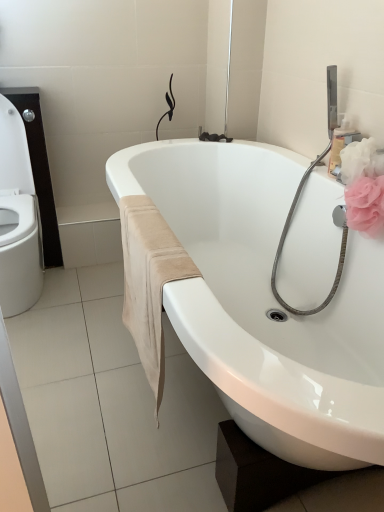
Where is `black rubber faucet at upper center`? black rubber faucet at upper center is located at coordinates (213, 137).

Where is `beige suede towel at lower center`? This screenshot has height=512, width=384. beige suede towel at lower center is located at coordinates (149, 281).

What do you see at coordinates (266, 302) in the screenshot? I see `white glossy bathtub at center` at bounding box center [266, 302].

I want to click on black rubber faucet at upper center, so click(x=213, y=137).

From the picture: Considering the sizes of objects beige suede towel at lower center and black rubber faucet at upper center in the image provided, who is wider, beige suede towel at lower center or black rubber faucet at upper center?

beige suede towel at lower center is wider.

Is point (149, 265) closer to viewer compared to point (217, 139)?

Yes, it is in front of point (217, 139).

From the image's perspective, between beige suede towel at lower center and black rubber faucet at upper center, who is located below?

beige suede towel at lower center is shown below in the image.

Does beige suede towel at lower center have a larger size compared to black rubber faucet at upper center?

Yes, beige suede towel at lower center is bigger than black rubber faucet at upper center.

Consider the image. Considering the relative sizes of black rubber faucet at upper center and pink fabric flower at upper right in the image provided, is black rubber faucet at upper center taller than pink fabric flower at upper right?

In fact, black rubber faucet at upper center may be shorter than pink fabric flower at upper right.

In the scene shown: Looking at their sizes, would you say black rubber faucet at upper center is wider or thinner than pink fabric flower at upper right?

Considering their sizes, black rubber faucet at upper center looks slimmer than pink fabric flower at upper right.

From the image's perspective, between black rubber faucet at upper center and pink fabric flower at upper right, which one is located above?

From the image's view, black rubber faucet at upper center is above.

Can you confirm if black rubber faucet at upper center is positioned to the right of pink fabric flower at upper right?

Incorrect, black rubber faucet at upper center is not on the right side of pink fabric flower at upper right.

Can you tell me how much pink fabric flower at upper right and black rubber faucet at upper center differ in facing direction?

They differ by 18.5 degrees in their facing directions.

Is pink fabric flower at upper right facing towards black rubber faucet at upper center?

No, pink fabric flower at upper right is not oriented towards black rubber faucet at upper center.

Which object is further away from the camera, pink fabric flower at upper right or black rubber faucet at upper center?

Positioned behind is black rubber faucet at upper center.

Is white glossy bathtub at center to the left or to the right of beige suede towel at lower center in the image?

white glossy bathtub at center is to the right of beige suede towel at lower center.

How many degrees apart are the facing directions of white glossy bathtub at center and beige suede towel at lower center?

white glossy bathtub at center and beige suede towel at lower center are facing 0.68 degrees away from each other.

Is white glossy bathtub at center taller or shorter than beige suede towel at lower center?

Clearly, white glossy bathtub at center is taller compared to beige suede towel at lower center.

Who is smaller, white glossy bathtub at center or beige suede towel at lower center?

beige suede towel at lower center.

Is beige suede towel at lower center in contact with pink fabric flower at upper right?

No, beige suede towel at lower center is not touching pink fabric flower at upper right.

Which is in front, beige suede towel at lower center or pink fabric flower at upper right?

beige suede towel at lower center is more forward.

Is beige suede towel at lower center oriented away from pink fabric flower at upper right?

Yes, pink fabric flower at upper right is at the back of beige suede towel at lower center.

Where is `bath towel that appears below the black rubber faucet at upper center (from the image's perspective)`? The image size is (384, 512). bath towel that appears below the black rubber faucet at upper center (from the image's perspective) is located at coordinates (149, 281).

Is black rubber faucet at upper center not near beige suede towel at lower center?

Yes.

Is black rubber faucet at upper center to the right of beige suede towel at lower center from the viewer's perspective?

Indeed, black rubber faucet at upper center is positioned on the right side of beige suede towel at lower center.

In the scene shown: Considering their positions, is white glossy bathtub at center located in front of or behind pink fabric flower at upper right?

In the image, white glossy bathtub at center appears in front of pink fabric flower at upper right.

In terms of height, does white glossy bathtub at center look taller or shorter compared to pink fabric flower at upper right?

Considering their sizes, white glossy bathtub at center has more height than pink fabric flower at upper right.

Considering the sizes of white glossy bathtub at center and pink fabric flower at upper right in the image, is white glossy bathtub at center bigger or smaller than pink fabric flower at upper right?

In the image, white glossy bathtub at center appears to be larger than pink fabric flower at upper right.

Are white glossy bathtub at center and pink fabric flower at upper right beside each other?

No, white glossy bathtub at center is not next to pink fabric flower at upper right.

You are a GUI agent. You are given a task and a screenshot of the screen. Output one action in this format:
    pyautogui.click(x=<x>, y=<y>)
    Task: Click on the bath towel below the black rubber faucet at upper center (from a real-world perspective)
    Image resolution: width=384 pixels, height=512 pixels.
    Given the screenshot: What is the action you would take?
    pyautogui.click(x=149, y=281)

Locate an element on the screen. The width and height of the screenshot is (384, 512). plumbing fixture that is on the left side of pink fabric flower at upper right is located at coordinates (213, 137).

Considering their positions, is black rubber faucet at upper center positioned closer to beige suede towel at lower center than pink fabric flower at upper right?

Based on the image, pink fabric flower at upper right appears to be nearer to beige suede towel at lower center.

From the image, which object appears to be farther from pink fabric flower at upper right, white glossy bathtub at center or beige suede towel at lower center?

beige suede towel at lower center is further to pink fabric flower at upper right.

From the image, which object appears to be farther from white glossy bathtub at center, beige suede towel at lower center or black rubber faucet at upper center?

Based on the image, black rubber faucet at upper center appears to be further to white glossy bathtub at center.

Considering their positions, is black rubber faucet at upper center positioned further to white glossy bathtub at center than pink fabric flower at upper right?

black rubber faucet at upper center.

Which object lies further to the anchor point beige suede towel at lower center, pink fabric flower at upper right or white glossy bathtub at center?

Among the two, pink fabric flower at upper right is located further to beige suede towel at lower center.

From the image, which object appears to be farther from black rubber faucet at upper center, white glossy bathtub at center or pink fabric flower at upper right?

pink fabric flower at upper right lies further to black rubber faucet at upper center than the other object.

Estimate the real-world distances between objects in this image. Which object is closer to black rubber faucet at upper center, pink fabric flower at upper right or beige suede towel at lower center?

Based on the image, pink fabric flower at upper right appears to be nearer to black rubber faucet at upper center.

Based on their spatial positions, is white glossy bathtub at center or black rubber faucet at upper center further from beige suede towel at lower center?

black rubber faucet at upper center is positioned further to the anchor beige suede towel at lower center.

The width and height of the screenshot is (384, 512). I want to click on flower between beige suede towel at lower center and black rubber faucet at upper center from front to back, so click(x=366, y=205).

This screenshot has height=512, width=384. Identify the location of bath towel positioned between white glossy bathtub at center and black rubber faucet at upper center from near to far. (149, 281).

Image resolution: width=384 pixels, height=512 pixels. Identify the location of bath towel between white glossy bathtub at center and pink fabric flower at upper right from front to back. (149, 281).

Image resolution: width=384 pixels, height=512 pixels. I want to click on flower positioned between white glossy bathtub at center and black rubber faucet at upper center from near to far, so click(x=366, y=205).